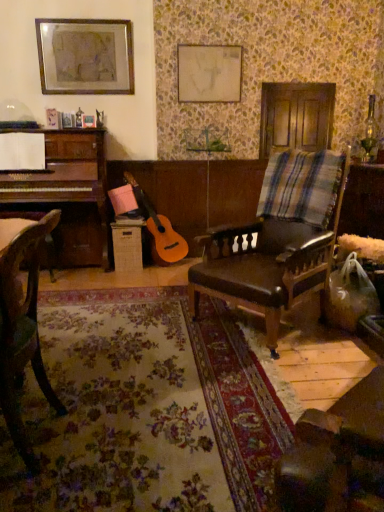
Question: From the image's perspective, is matte white canvas at upper center, which appears as the 1th picture frame when viewed from the right, under wooden chair at left, the second chair viewed from the back?

Choices:
 (A) no
 (B) yes

Answer: (A)

Question: Is matte white canvas at upper center, which appears as the 1th picture frame when viewed from the right, positioned before wooden chair at left, the second chair viewed from the back?

Choices:
 (A) yes
 (B) no

Answer: (B)

Question: From a real-world perspective, does matte white canvas at upper center, which appears as the 1th picture frame when viewed from the right, stand above wooden chair at left, which is the 1th chair from left to right?

Choices:
 (A) no
 (B) yes

Answer: (B)

Question: Can you confirm if matte white canvas at upper center, which appears as the 1th picture frame when viewed from the right, is smaller than wooden chair at left, the second chair viewed from the back?

Choices:
 (A) yes
 (B) no

Answer: (A)

Question: Does matte white canvas at upper center, which appears as the 1th picture frame when viewed from the right, contain wooden chair at left, which is the 1th chair from left to right?

Choices:
 (A) yes
 (B) no

Answer: (B)

Question: Considering the positions of matte white canvas at upper center, which appears as the 1th picture frame when viewed from the right, and wooden chair at left, acting as the second chair starting from the right, in the image, is matte white canvas at upper center, which appears as the 1th picture frame when viewed from the right, taller or shorter than wooden chair at left, acting as the second chair starting from the right,?

Choices:
 (A) tall
 (B) short

Answer: (B)

Question: Considering the positions of matte white canvas at upper center, which appears as the 1th picture frame when viewed from the right, and wooden chair at left, which is the 1th chair from left to right, in the image, is matte white canvas at upper center, which appears as the 1th picture frame when viewed from the right, wider or thinner than wooden chair at left, which is the 1th chair from left to right,?

Choices:
 (A) wide
 (B) thin

Answer: (B)

Question: Relative to wooden chair at left, acting as the second chair starting from the right, is matte white canvas at upper center, which appears as the 1th picture frame when viewed from the right, in front or behind?

Choices:
 (A) front
 (B) behind

Answer: (B)

Question: In terms of size, does matte white canvas at upper center, the 2th picture frame when ordered from left to right, appear bigger or smaller than wooden chair at left, which is counted as the first chair, starting from the front?

Choices:
 (A) big
 (B) small

Answer: (B)

Question: Considering their positions, is brown leather chair at center, the 2th chair when ordered from left to right, located in front of or behind wooden chair at left, the second chair viewed from the back?

Choices:
 (A) behind
 (B) front

Answer: (A)

Question: Choose the correct answer: Is brown leather chair at center, which ranks as the second chair in front-to-back order, inside wooden chair at left, acting as the second chair starting from the right, or outside it?

Choices:
 (A) outside
 (B) inside

Answer: (A)

Question: In terms of size, does brown leather chair at center, marked as the first chair in a right-to-left arrangement, appear bigger or smaller than wooden chair at left, which is counted as the first chair, starting from the front?

Choices:
 (A) small
 (B) big

Answer: (B)

Question: Is brown leather chair at center, marked as the first chair in a right-to-left arrangement, wider or thinner than wooden chair at left, which is counted as the first chair, starting from the front?

Choices:
 (A) thin
 (B) wide

Answer: (B)

Question: Is matte white canvas at upper center, the 2th picture frame when ordered from left to right, in front of or behind plaid fabric at right in the image?

Choices:
 (A) front
 (B) behind

Answer: (B)

Question: Looking at the image, does matte white canvas at upper center, which appears as the 1th picture frame when viewed from the right, seem bigger or smaller compared to plaid fabric at right?

Choices:
 (A) big
 (B) small

Answer: (B)